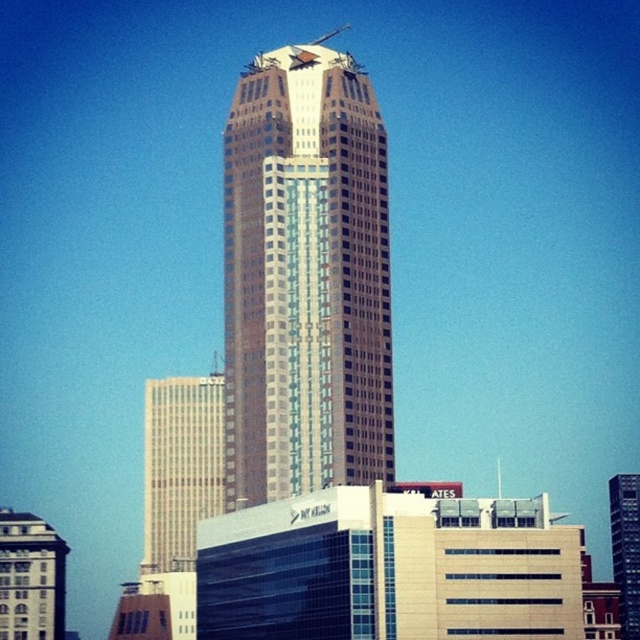
You are a drone operator tasked with capturing aerial footage of the cityscape. Your drone has a maximum flight range of 700 feet. You need to fly the drone to the point at coordinates point (x=156, y=444) to capture a shot. Will your drone be able to reach that point without exceeding its range?

The point (x=156, y=444) is 671.38 feet from the camera, which is within the drone operator drone maximum flight range of 700 feet. Therefore, the drone can reach the point without exceeding its range.

You are a city planner reviewing the construction plans. You need to determine if the beige glass building at left can be seen from the observation deck of the glassy reflective skyscraper at center. Based on their sizes and positions, what do you conclude?

The beige glass building at left is smaller than the glassy reflective skyscraper at center, so it is possible that the beige glass building at left could be visible from the observation deck of the glassy reflective skyscraper at center, depending on the exact positioning and line of sight.

You are a construction inspector standing at the point labeled point (305, 278). What object are you currently standing on?

The point labeled point (305, 278) indicates the glassy steel skyscraper at center, so you are standing on the glassy steel skyscraper at center.